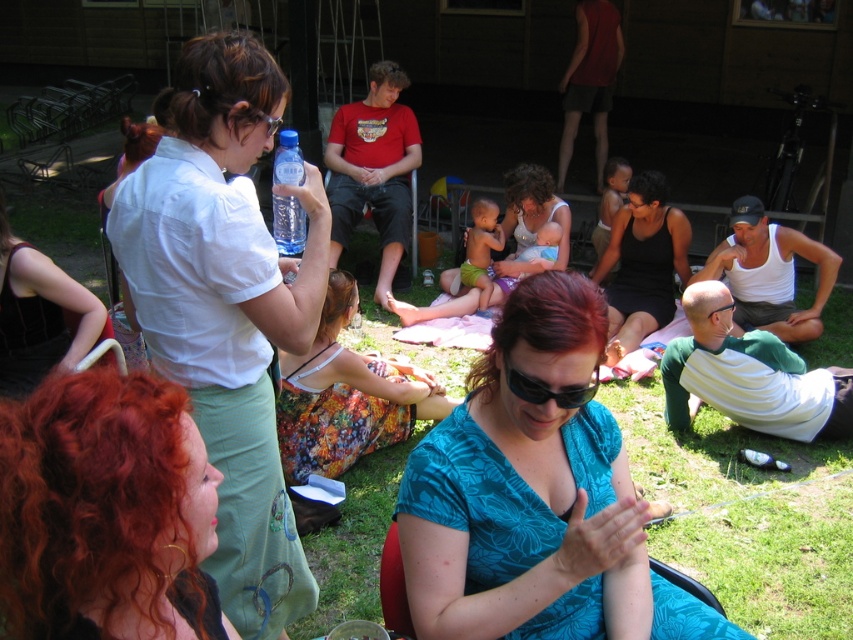
This screenshot has width=853, height=640. Describe the element at coordinates (534, 209) in the screenshot. I see `matte white tank top at center` at that location.

Can you confirm if matte white tank top at center is smaller than black plastic sunglasses at center?

No.

This screenshot has height=640, width=853. In order to click on matte white tank top at center in this screenshot , I will do `click(534, 209)`.

Where is `matte white tank top at center`? This screenshot has height=640, width=853. matte white tank top at center is located at coordinates (534, 209).

In the scene shown: Which is more to the right, white/green striped shirt at lower right or transparent plastic bottle at upper center?

From the viewer's perspective, white/green striped shirt at lower right appears more on the right side.

Does white/green striped shirt at lower right appear on the left side of transparent plastic bottle at upper center?

No, white/green striped shirt at lower right is not to the left of transparent plastic bottle at upper center.

Between point (766, 419) and point (289, 147), which one is positioned behind?

Point (766, 419)

Where is `white/green striped shirt at lower right`? The width and height of the screenshot is (853, 640). white/green striped shirt at lower right is located at coordinates (749, 376).

Does floral fabric dress at center have a larger size compared to white/green striped shirt at lower right?

Yes.

You are a GUI agent. You are given a task and a screenshot of the screen. Output one action in this format:
    pyautogui.click(x=<x>, y=<y>)
    Task: Click on the floral fabric dress at center
    The height and width of the screenshot is (640, 853).
    Given the screenshot: What is the action you would take?
    pyautogui.click(x=345, y=396)

Locate an element on the screen. Image resolution: width=853 pixels, height=640 pixels. floral fabric dress at center is located at coordinates (345, 396).